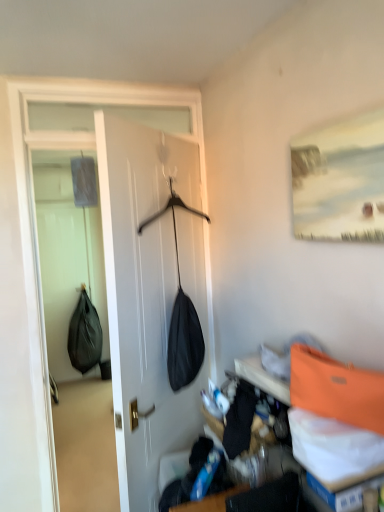
Question: Considering the positions of orange fabric shoulder bag at upper right, marked as the first shoulder bag in a right-to-left arrangement, and black matte shoulder bag at left, the 1th shoulder bag positioned from the back, in the image, is orange fabric shoulder bag at upper right, marked as the first shoulder bag in a right-to-left arrangement, taller or shorter than black matte shoulder bag at left, the 1th shoulder bag positioned from the back,?

Choices:
 (A) short
 (B) tall

Answer: (A)

Question: Based on their sizes in the image, would you say orange fabric shoulder bag at upper right, the 1th shoulder bag from the top, is bigger or smaller than black matte shoulder bag at left, which ranks as the 1th shoulder bag in left-to-right order?

Choices:
 (A) small
 (B) big

Answer: (A)

Question: Estimate the real-world distances between objects in this image. Which object is closer to the black matte shoulder bag at left, acting as the 1th shoulder bag starting from the bottom?

Choices:
 (A) black fabric bag at center
 (B) matte white painting at upper right
 (C) orange fabric shoulder bag at upper right, marked as the first shoulder bag in a right-to-left arrangement

Answer: (A)

Question: Estimate the real-world distances between objects in this image. Which object is closer to the matte white painting at upper right?

Choices:
 (A) black fabric bag at center
 (B) orange fabric shoulder bag at upper right, placed as the first shoulder bag when sorted from front to back
 (C) black matte shoulder bag at left, acting as the 1th shoulder bag starting from the bottom

Answer: (B)